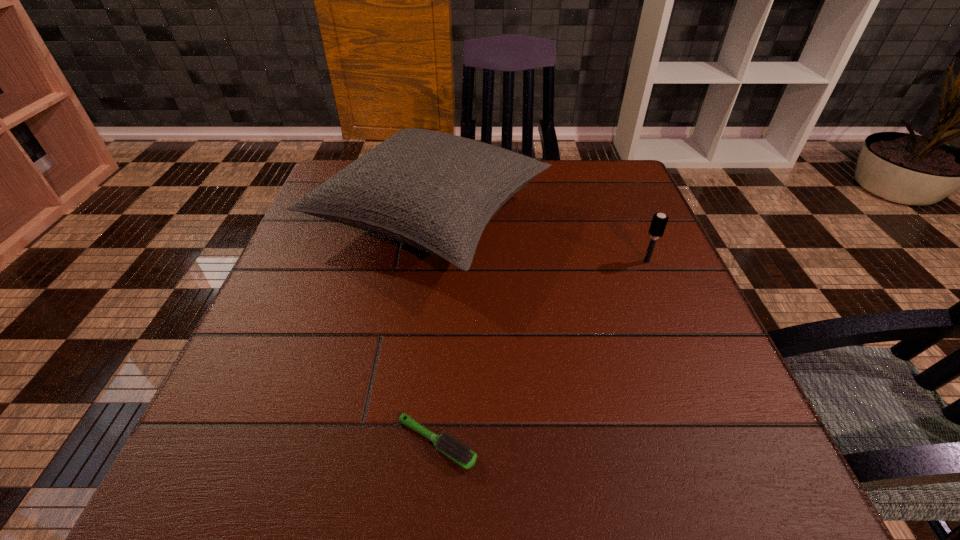
You are a GUI agent. You are given a task and a screenshot of the screen. Output one action in this format:
    pyautogui.click(x=<x>, y=<y>)
    Task: Click on the vacant region that satisfies the following two spatial constraints: 1. on the back side of the nearer hairbrush; 2. on the left side of the right hairbrush
    
    Given the screenshot: What is the action you would take?
    pyautogui.click(x=450, y=262)

In order to click on free location that satisfies the following two spatial constraints: 1. on the front side of the left hairbrush; 2. on the left side of the cushion in this screenshot , I will do `click(399, 443)`.